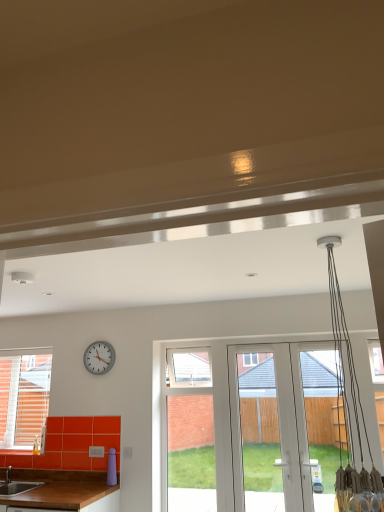
What do you see at coordinates (99, 357) in the screenshot? The image size is (384, 512). I see `white plastic clock at upper left` at bounding box center [99, 357].

The height and width of the screenshot is (512, 384). What do you see at coordinates (255, 433) in the screenshot?
I see `white glossy screen door at center` at bounding box center [255, 433].

In order to face white glossy screen door at center, should I rotate leftwards or rightwards?

Rotate right and turn 12.515 degrees.

Image resolution: width=384 pixels, height=512 pixels. Describe the element at coordinates (16, 485) in the screenshot. I see `matte brown sink at lower left` at that location.

The image size is (384, 512). I want to click on brown wooden countertop at lower left, so click(x=64, y=490).

Could you tell me if matte brown sink at lower left is facing brown wooden countertop at lower left?

No, matte brown sink at lower left does not turn towards brown wooden countertop at lower left.

In the scene shown: How far apart are matte brown sink at lower left and brown wooden countertop at lower left?

matte brown sink at lower left and brown wooden countertop at lower left are 12.51 inches apart from each other.

From a real-world perspective, is matte brown sink at lower left positioned above or below brown wooden countertop at lower left?

In terms of real-world spatial position, matte brown sink at lower left is above brown wooden countertop at lower left.

Between matte brown sink at lower left and brown wooden countertop at lower left, which one has smaller width?

matte brown sink at lower left is thinner.

From the image's perspective, is white glossy screen door at center located above white plastic clock at upper left?

Incorrect, from the image's perspective, white glossy screen door at center is lower than white plastic clock at upper left.

From a real-world perspective, is white glossy screen door at center on top of white plastic clock at upper left?

No, from a real-world perspective, white glossy screen door at center is not above white plastic clock at upper left.

Considering the sizes of objects white glossy screen door at center and white plastic clock at upper left in the image provided, who is smaller, white glossy screen door at center or white plastic clock at upper left?

white plastic clock at upper left.

Looking at this image, is white glossy screen door at center to the right of white plastic clock at upper left from the viewer's perspective?

Correct, you'll find white glossy screen door at center to the right of white plastic clock at upper left.

Is matte brown sink at lower left at the back of white plastic clock at upper left?

No, white plastic clock at upper left is not facing the opposite direction of matte brown sink at lower left.

Is white plastic clock at upper left located outside matte brown sink at lower left?

Yes, white plastic clock at upper left is located beyond the bounds of matte brown sink at lower left.

Which object is positioned more to the right, white plastic clock at upper left or matte brown sink at lower left?

white plastic clock at upper left.

Between white plastic clock at upper left and matte brown sink at lower left, which one has smaller size?

With smaller size is white plastic clock at upper left.

Looking at this image, is matte brown sink at lower left bigger or smaller than white glossy screen door at center?

Clearly, matte brown sink at lower left is larger in size than white glossy screen door at center.

From the image's perspective, is matte brown sink at lower left located above or below white glossy screen door at center?

matte brown sink at lower left is below white glossy screen door at center.

Which is more to the left, matte brown sink at lower left or white glossy screen door at center?

From the viewer's perspective, matte brown sink at lower left appears more on the left side.

In the scene shown: How distant is matte brown sink at lower left from white glossy screen door at center?

The distance of matte brown sink at lower left from white glossy screen door at center is 1.80 meters.

From a real-world perspective, who is located lower, white glossy screen door at center or matte brown sink at lower left?

matte brown sink at lower left.

Does white glossy screen door at center contain matte brown sink at lower left?

No, matte brown sink at lower left is not surrounded by white glossy screen door at center.

Between white glossy screen door at center and matte brown sink at lower left, which one has larger size?

matte brown sink at lower left.

The image size is (384, 512). What are the coordinates of `screen door that is above the matte brown sink at lower left (from the image's perspective)` in the screenshot? It's located at (255, 433).

From a real-world perspective, is white plastic clock at upper left below white glossy screen door at center?

No, from a real-world perspective, white plastic clock at upper left is not under white glossy screen door at center.

Is white plastic clock at upper left not within white glossy screen door at center?

Absolutely, white plastic clock at upper left is external to white glossy screen door at center.

Is white plastic clock at upper left taller than white glossy screen door at center?

No, white plastic clock at upper left is not taller than white glossy screen door at center.

Is white plastic clock at upper left next to white glossy screen door at center and touching it?

No, white plastic clock at upper left is not touching white glossy screen door at center.

Considering the relative sizes of white plastic clock at upper left and brown wooden countertop at lower left in the image provided, is white plastic clock at upper left taller than brown wooden countertop at lower left?

In fact, white plastic clock at upper left may be shorter than brown wooden countertop at lower left.

Does point (106, 343) come in front of point (43, 493)?

No, it is not.

Is white plastic clock at upper left at the left side of brown wooden countertop at lower left?

In fact, white plastic clock at upper left is to the right of brown wooden countertop at lower left.

Is white plastic clock at upper left not close to brown wooden countertop at lower left?

Yes.

You are a GUI agent. You are given a task and a screenshot of the screen. Output one action in this format:
    pyautogui.click(x=<x>, y=<y>)
    Task: Click on the sink above the brown wooden countertop at lower left (from the image's perspective)
    The width and height of the screenshot is (384, 512).
    Given the screenshot: What is the action you would take?
    pyautogui.click(x=16, y=485)

Find the location of a particular element. This screenshot has width=384, height=512. screen door in front of the white plastic clock at upper left is located at coordinates (255, 433).

When comparing their distances from white glossy screen door at center, does matte brown sink at lower left or white plastic clock at upper left seem closer?

white plastic clock at upper left lies closer to white glossy screen door at center than the other object.

From the image, which object appears to be nearer to white glossy screen door at center, matte brown sink at lower left or brown wooden countertop at lower left?

Among the two, brown wooden countertop at lower left is located nearer to white glossy screen door at center.

Based on the photo, when comparing their distances from matte brown sink at lower left, does brown wooden countertop at lower left or white glossy screen door at center seem further?

The object further to matte brown sink at lower left is white glossy screen door at center.

When comparing their distances from white plastic clock at upper left, does white glossy screen door at center or matte brown sink at lower left seem further?

white glossy screen door at center lies further to white plastic clock at upper left than the other object.

Estimate the real-world distances between objects in this image. Which object is further from brown wooden countertop at lower left, white plastic clock at upper left or white glossy screen door at center?

white glossy screen door at center is positioned further to the anchor brown wooden countertop at lower left.

Considering their positions, is brown wooden countertop at lower left positioned further to white glossy screen door at center than matte brown sink at lower left?

Among the two, matte brown sink at lower left is located further to white glossy screen door at center.

Which object lies further to the anchor point matte brown sink at lower left, white plastic clock at upper left or white glossy screen door at center?

white glossy screen door at center is positioned further to the anchor matte brown sink at lower left.

Looking at the image, which one is located further to white plastic clock at upper left, brown wooden countertop at lower left or white glossy screen door at center?

The object further to white plastic clock at upper left is white glossy screen door at center.

Where is `clock between brown wooden countertop at lower left and white glossy screen door at center in the horizontal direction`? clock between brown wooden countertop at lower left and white glossy screen door at center in the horizontal direction is located at coordinates (99, 357).

In order to click on countertop between matte brown sink at lower left and white glossy screen door at center from left to right in this screenshot , I will do [x=64, y=490].

I want to click on clock between matte brown sink at lower left and white glossy screen door at center, so click(99, 357).

What are the coordinates of `sink between white plastic clock at upper left and brown wooden countertop at lower left in the up-down direction` in the screenshot? It's located at (16, 485).